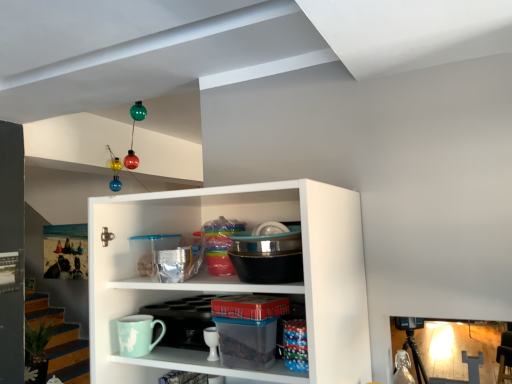
Identify the location of clear plastic container at center. (210, 366).

What do you see at coordinates (210, 366) in the screenshot? I see `clear plastic container at center` at bounding box center [210, 366].

In order to face clear plastic container at center, should I rotate leftwards or rightwards?

Turn right by 1.477 degrees to look at clear plastic container at center.

I want to click on mint matte mug at lower center, so click(x=137, y=334).

What do you see at coordinates (137, 334) in the screenshot? I see `mint matte mug at lower center` at bounding box center [137, 334].

This screenshot has height=384, width=512. Identify the location of clear plastic container at center. (210, 366).

Which object is positioned more to the left, clear plastic container at center or mint matte mug at lower center?

Positioned to the left is mint matte mug at lower center.

Which object is further away from the camera, clear plastic container at center or mint matte mug at lower center?

Positioned behind is mint matte mug at lower center.

Is point (180, 360) closer to camera compared to point (139, 346)?

Yes, point (180, 360) is closer to viewer.

From the image's perspective, which one is positioned lower, clear plastic container at center or mint matte mug at lower center?

From the image's view, mint matte mug at lower center is below.

From a real-world perspective, is clear plastic container at center beneath mint matte mug at lower center?

No, from a real-world perspective, clear plastic container at center is not beneath mint matte mug at lower center.

From the picture: Looking at their sizes, would you say clear plastic container at center is wider or thinner than mint matte mug at lower center?

Considering their sizes, clear plastic container at center looks broader than mint matte mug at lower center.

Considering the relative sizes of clear plastic container at center and mint matte mug at lower center in the image provided, is clear plastic container at center taller than mint matte mug at lower center?

Yes, clear plastic container at center is taller than mint matte mug at lower center.

In terms of size, does clear plastic container at center appear bigger or smaller than mint matte mug at lower center?

Clearly, clear plastic container at center is larger in size than mint matte mug at lower center.

Is clear plastic container at center surrounding mint matte mug at lower center?

No, mint matte mug at lower center is not inside clear plastic container at center.

Is clear plastic container at center far from mint matte mug at lower center?

clear plastic container at center is near mint matte mug at lower center, not far away.

Is clear plastic container at center aimed at mint matte mug at lower center?

No, clear plastic container at center is not oriented towards mint matte mug at lower center.

This screenshot has height=384, width=512. Find the location of `mug that is on the left side of clear plastic container at center`. mug that is on the left side of clear plastic container at center is located at coordinates (137, 334).

Considering the relative positions of mint matte mug at lower center and clear plastic container at center in the image provided, is mint matte mug at lower center to the left or to the right of clear plastic container at center?

In the image, mint matte mug at lower center appears on the left side of clear plastic container at center.

Which object is closer to the camera, mint matte mug at lower center or clear plastic container at center?

clear plastic container at center.

Is point (139, 336) positioned behind point (154, 367)?

That is False.

From the image's perspective, is mint matte mug at lower center over clear plastic container at center?

No, from the image's perspective, mint matte mug at lower center is not above clear plastic container at center.

From a real-world perspective, which object stands above the other?

clear plastic container at center is physically above.

Considering the sizes of objects mint matte mug at lower center and clear plastic container at center in the image provided, who is wider, mint matte mug at lower center or clear plastic container at center?

clear plastic container at center is wider.

Between mint matte mug at lower center and clear plastic container at center, which one has less height?

mint matte mug at lower center.

Which of these two, mint matte mug at lower center or clear plastic container at center, is smaller?

mint matte mug at lower center.

Is mint matte mug at lower center located outside clear plastic container at center?

mint matte mug at lower center lies outside clear plastic container at center's area.

Is there a large distance between mint matte mug at lower center and clear plastic container at center?

That's not correct — mint matte mug at lower center is a little close to clear plastic container at center.

Is mint matte mug at lower center facing towards clear plastic container at center?

No, mint matte mug at lower center is not oriented towards clear plastic container at center.

Based on the photo, how different are the orientations of mint matte mug at lower center and clear plastic container at center in degrees?

The angular difference between mint matte mug at lower center and clear plastic container at center is 1.65 degrees.

Identify the location of cabinet above the mint matte mug at lower center (from a real-world perspective). The height and width of the screenshot is (384, 512). (210, 366).

Locate an element on the screen. The width and height of the screenshot is (512, 384). cabinet that is in front of the mint matte mug at lower center is located at coordinates (210, 366).

You are a GUI agent. You are given a task and a screenshot of the screen. Output one action in this format:
    pyautogui.click(x=<x>, y=<y>)
    Task: Click on the mug below the clear plastic container at center (from a real-world perspective)
    
    Given the screenshot: What is the action you would take?
    pyautogui.click(x=137, y=334)